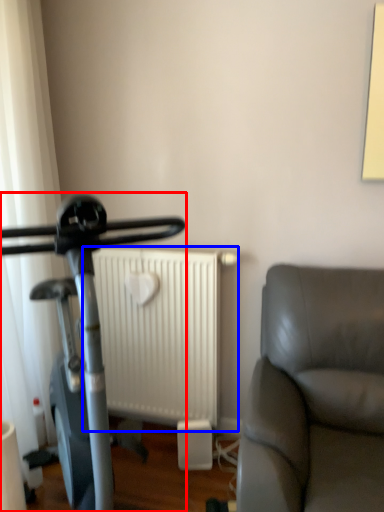
Question: Which object is further to the camera taking this photo, stationary bicycle (highlighted by a red box) or radiator (highlighted by a blue box)?

Choices:
 (A) stationary bicycle
 (B) radiator

Answer: (B)